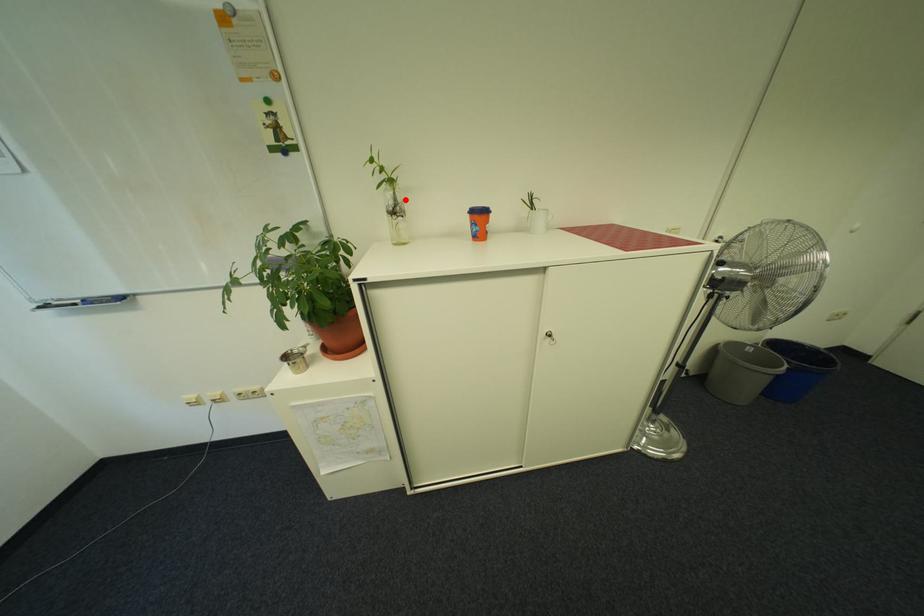
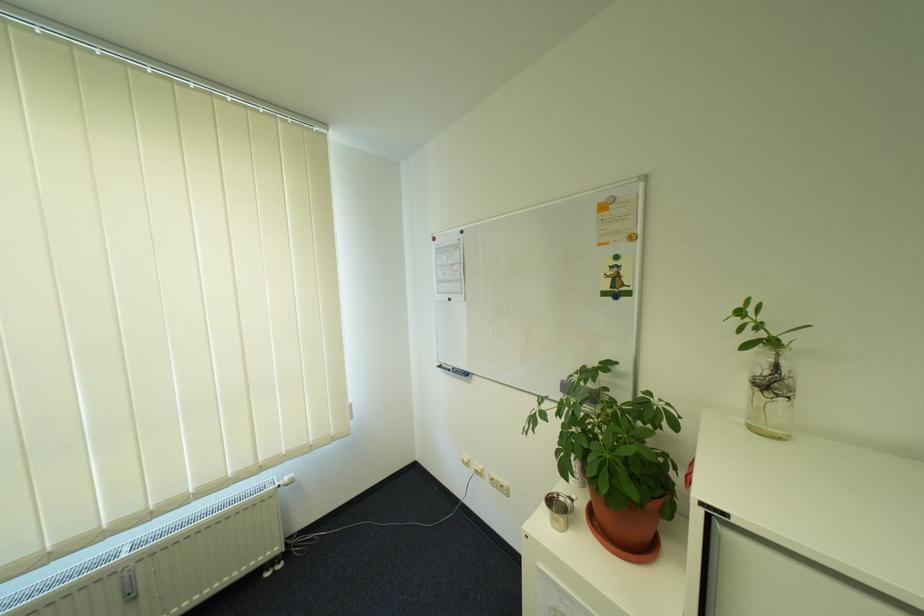
The point at the highlighted location is marked in the first image. Where is the corresponding point in the second image?

(785, 369)